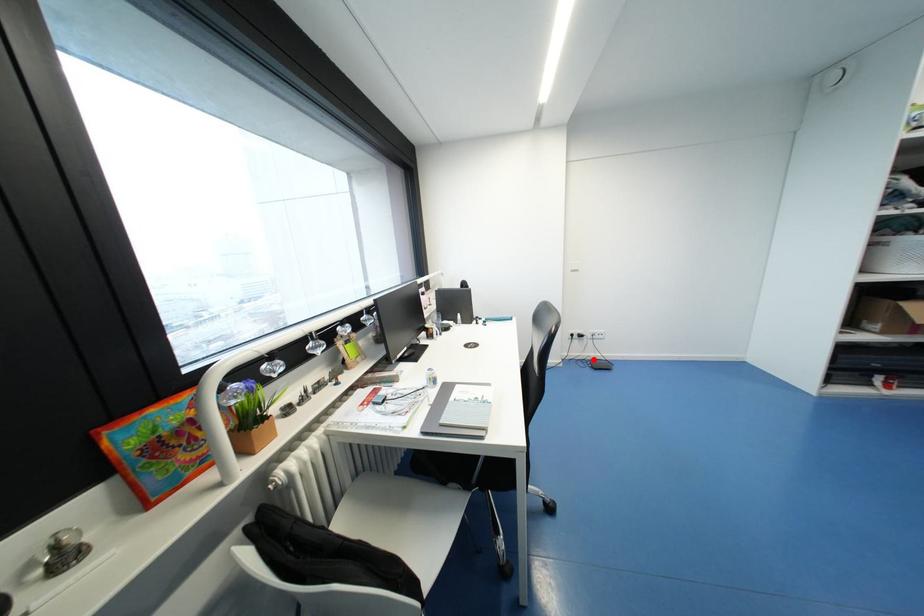
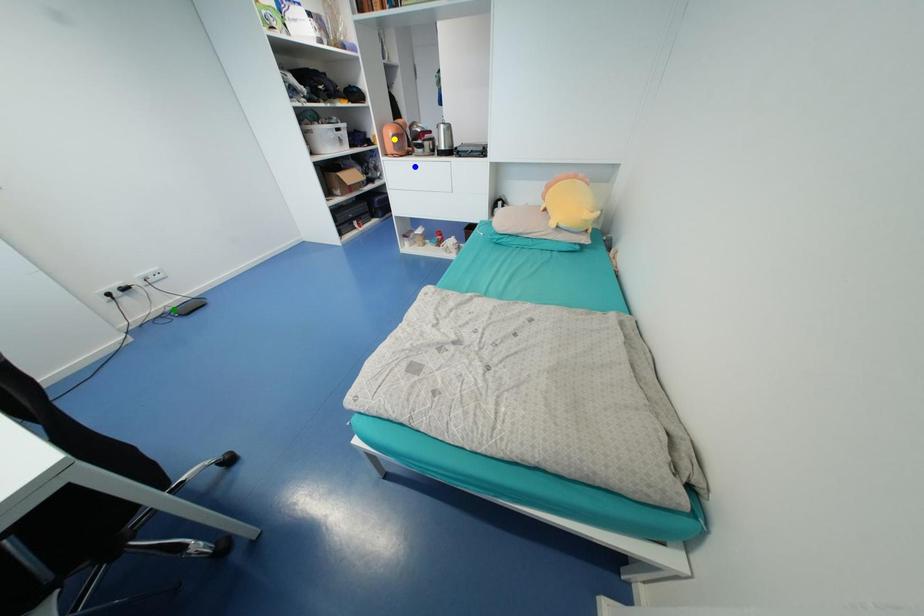
Question: I am providing you with two images of the same scene from different viewpoints. A red point is marked on the first image. You are given multiple points on the second image. Can you choose the point in image 2 that corresponds to the point in image 1?

Choices:
 (A) yellow point
 (B) green point
 (C) blue point

Answer: (B)